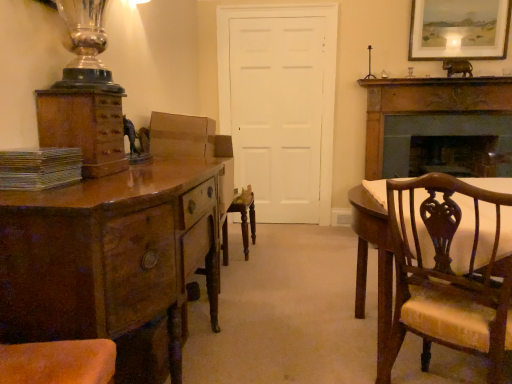
Image resolution: width=512 pixels, height=384 pixels. What are the coordinates of `vacant area located to the right-hand side of brown wood cabinet at left` in the screenshot? It's located at (139, 177).